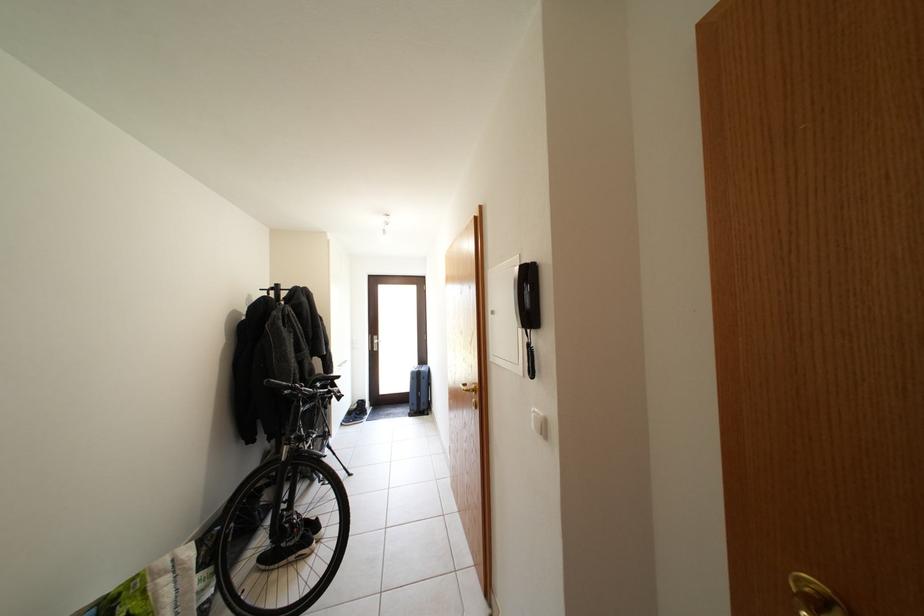
Which object does [539,423] point to?

It corresponds to the white light switch in the image.